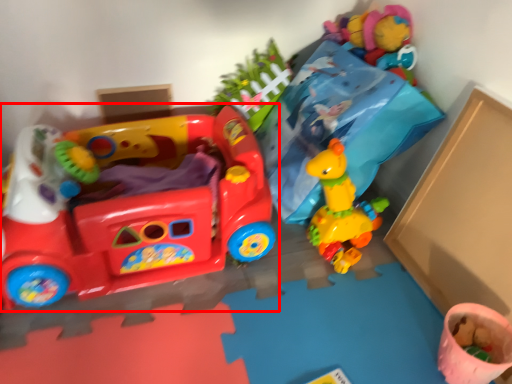
Question: Where is toy (annotated by the red box) located in relation to toy in the image?

Choices:
 (A) left
 (B) right

Answer: (A)